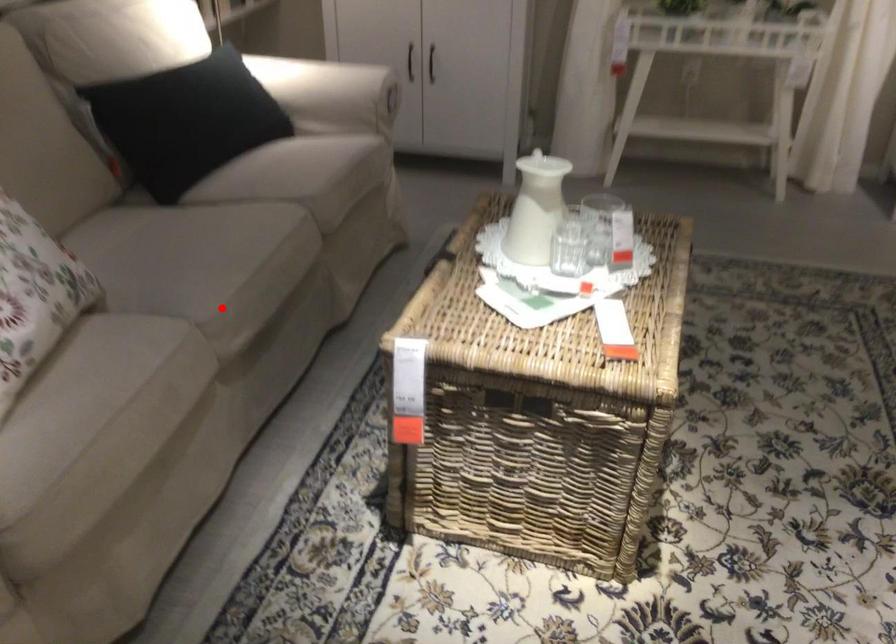
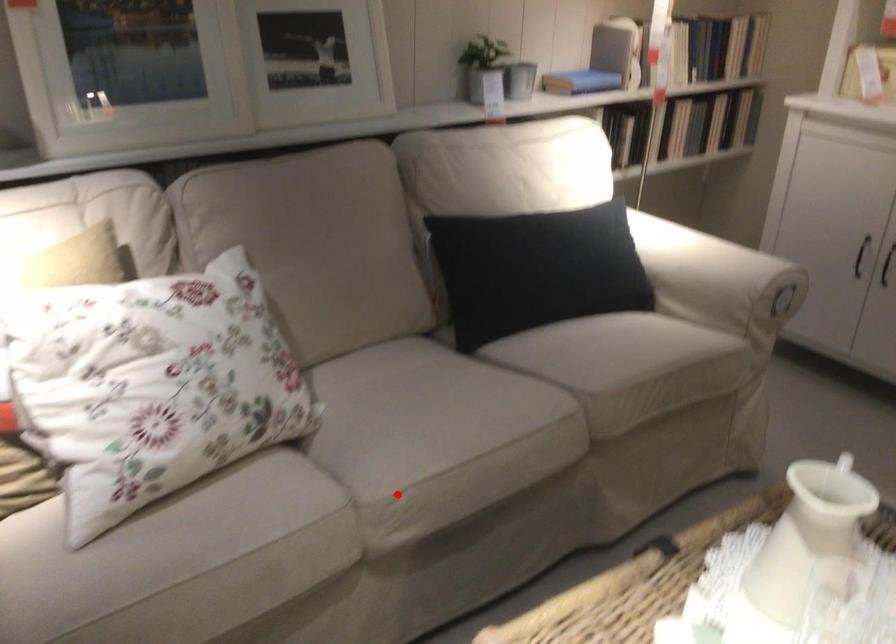
I am providing you with two images of the same scene from different viewpoints. A red point is marked on the first image and another point is marked on the second image. Is the marked point in image1 the same physical position as the marked point in image2?

Yes